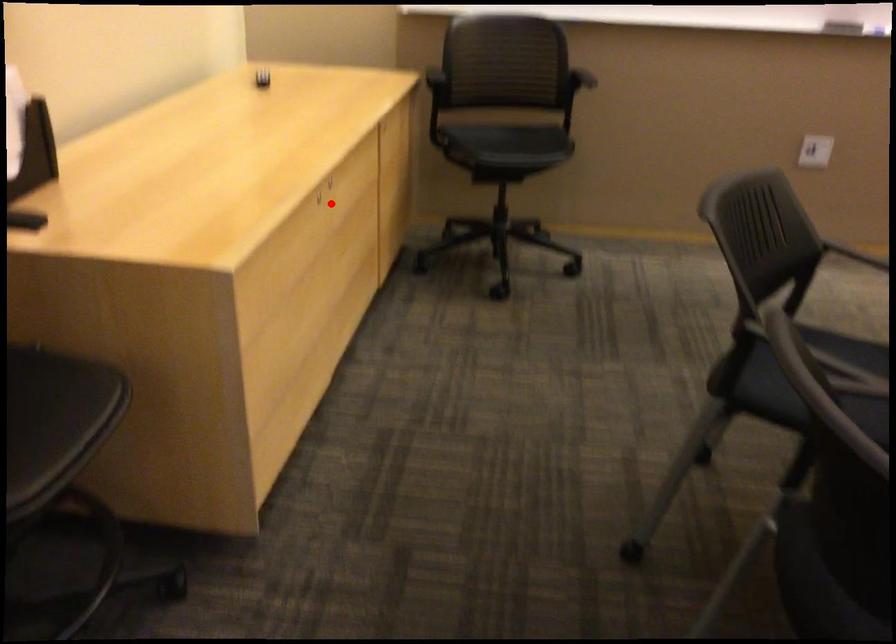
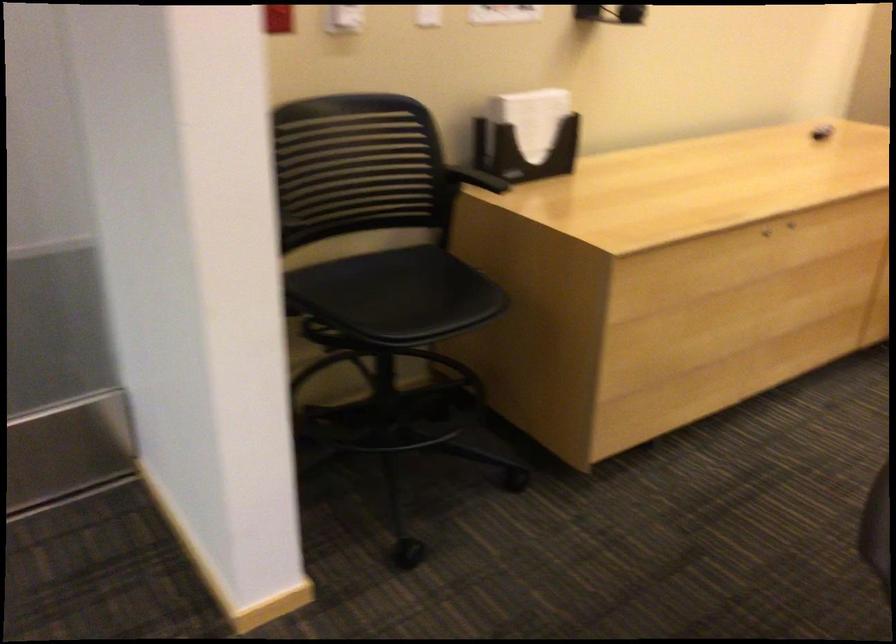
Question: A red point is marked in image1. In image2, is the corresponding 3D point closer to the camera or farther? Reply with the corresponding letter.

Choices:
 (A) The corresponding 3D point is closer.
 (B) The corresponding 3D point is farther.

Answer: (B)